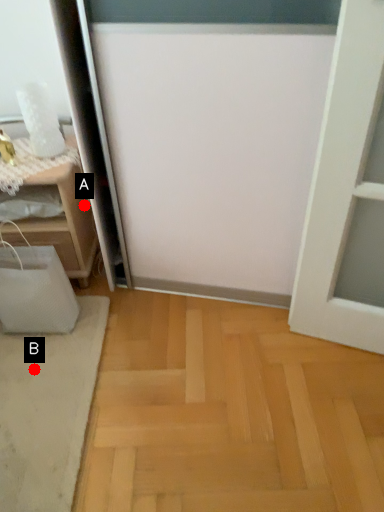
Question: Two points are circled on the image, labeled by A and B beside each circle. Which point is closer to the camera?

Choices:
 (A) A is closer
 (B) B is closer

Answer: (B)